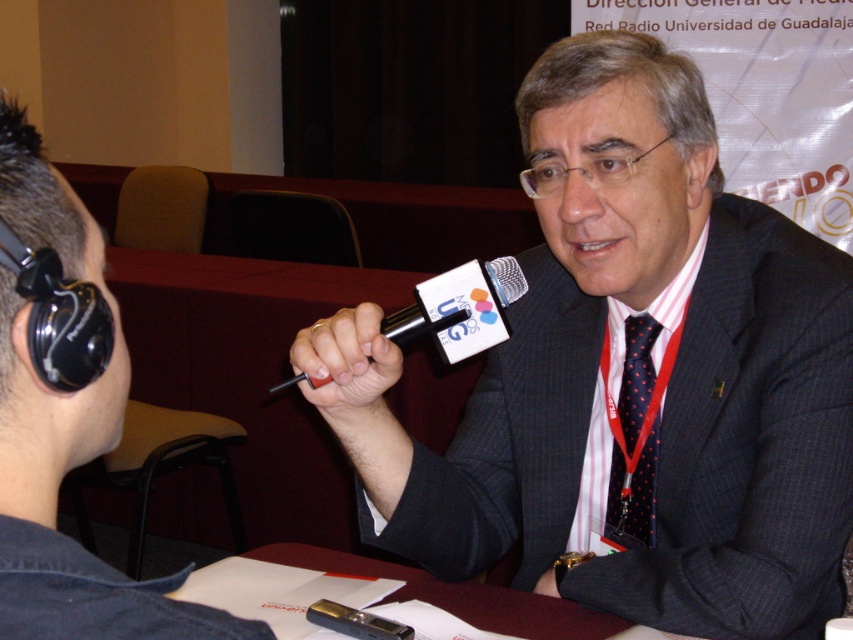
In the scene shown: You are a photographer in the room and want to capture a clear shot of both the black plastic microphone at center and the black rubber microphone at center. Which microphone should you focus on first to ensure it appears sharp in the photo?

The black plastic microphone at center is above the black rubber microphone at center, so you should focus on the black plastic microphone at center first since it is closer to the camera.

You are a photographer positioned in front of the two microphones at center. You want to take a photo where the black plastic microphone at center appears larger in the frame than the black rubber microphone at center. Which microphone should you move closer to the camera to achieve this effect?

To make the black plastic microphone at center appear larger in the frame than the black rubber microphone at center, you should move the black plastic microphone at center closer to the camera. Since it is already closer to the viewer, moving it even closer would increase its apparent size relative to the other microphone.